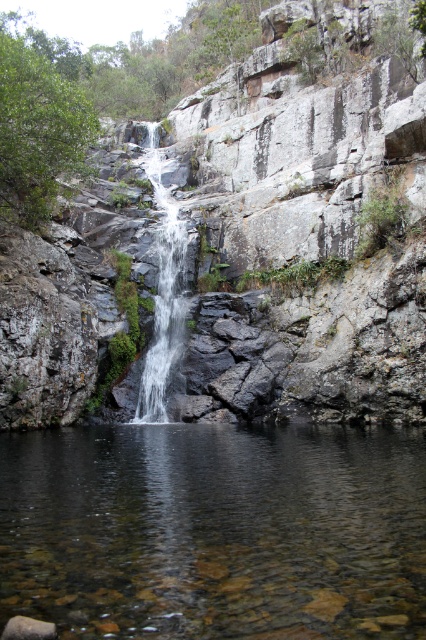
You are standing at the edge of the pool and want to reach the gray rock cliff at center behind the clear water at center. Can you walk directly to the cliff through the water?

The gray rock cliff at center is further to the viewer than clear water at center, meaning the cliff is closer to you than the water. Therefore, you can walk directly to the gray rock cliff at center through the clear water at center since it is in front of the water.

You are standing at the edge of the pool and want to cross to the other side. You see the gray rock cliff at center and the clear glass waterfall at center. Which object is closer to you, and can you safely step on it to cross?

The gray rock cliff at center is closer to you than the clear glass waterfall at center. However, the clear glass waterfall at center is flowing water and not a solid surface, so stepping on it is not safe. You should avoid both and find another way to cross.